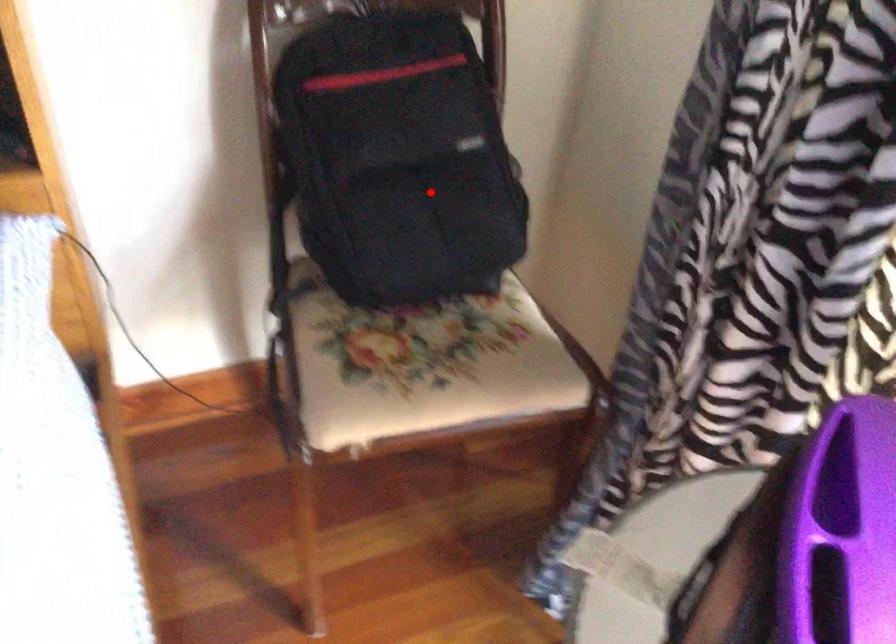
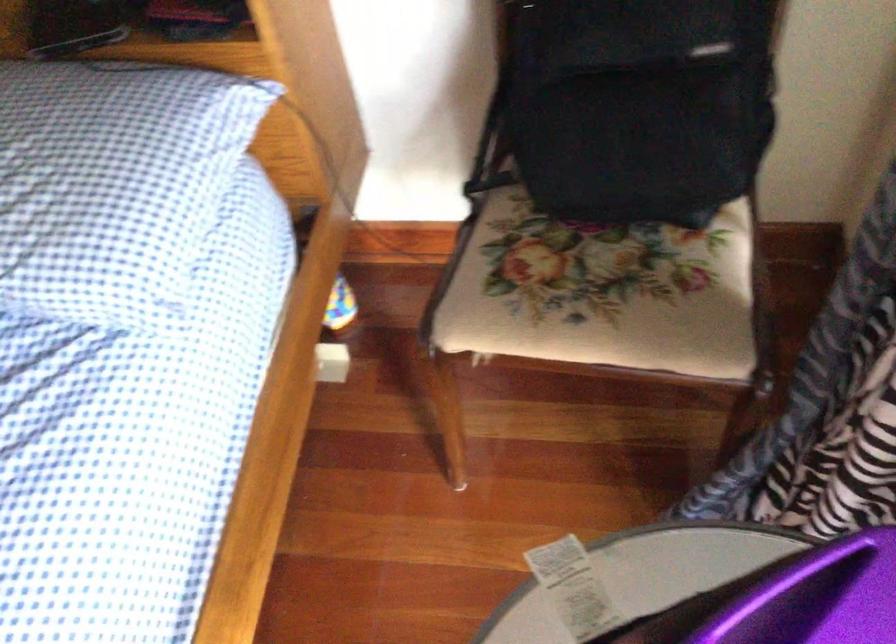
In the second image, find the point that corresponds to the highlighted location in the first image.

(639, 104)